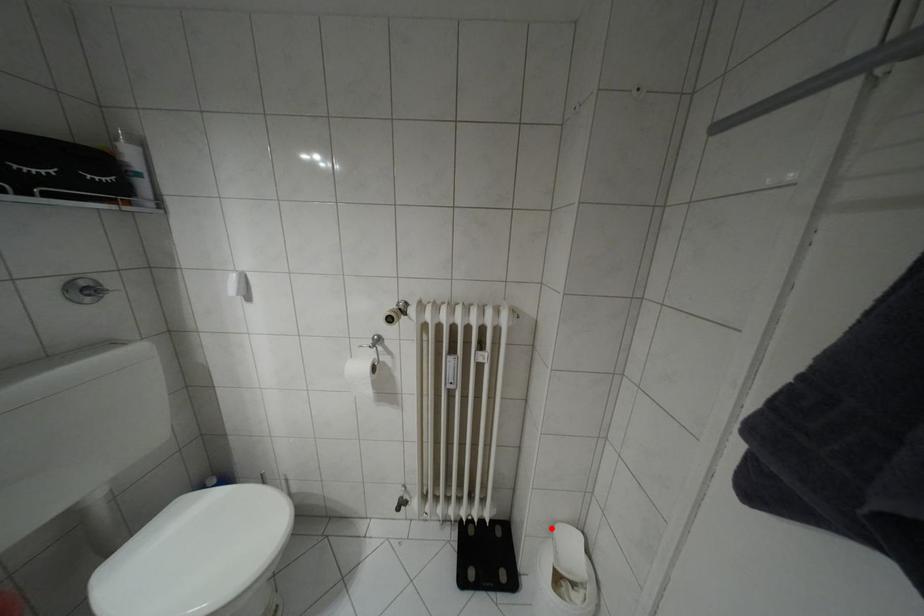
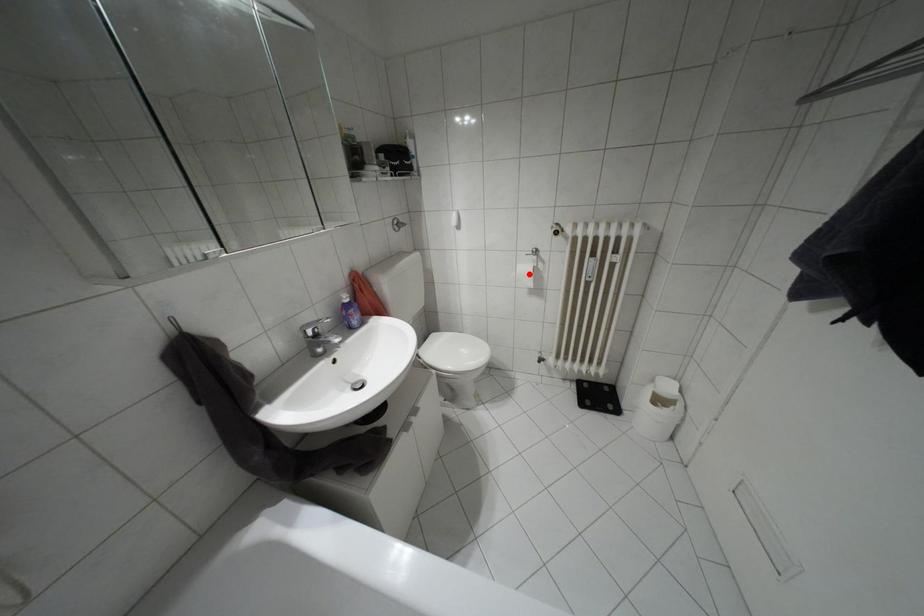
I am providing you with two images of the same scene from different viewpoints. A red point is marked on the first image and another point is marked on the second image. Is the red point in image1 aligned with the point shown in image2?

No